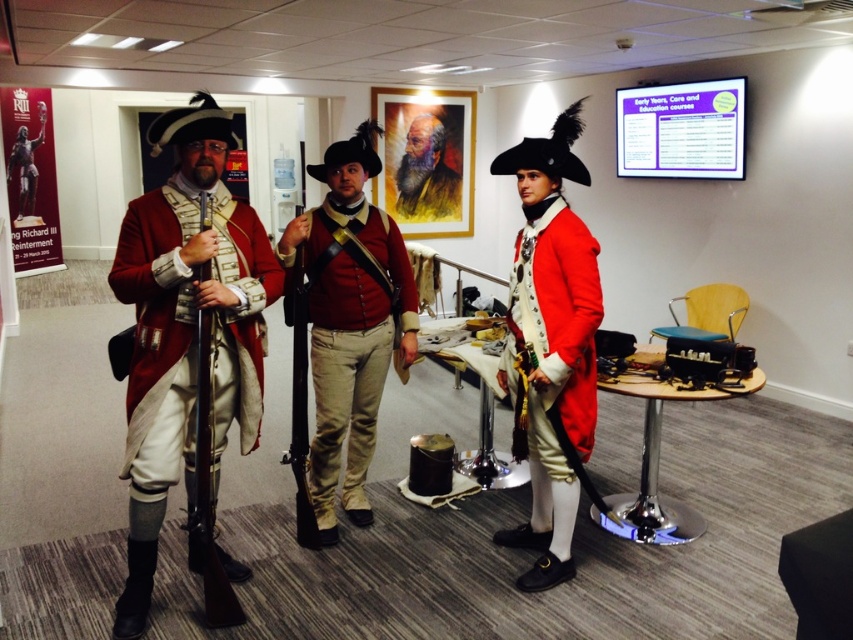
Between matte red coat at left and wooden smooth rifle at center, which one is positioned lower?

Positioned lower is wooden smooth rifle at center.

Is matte red coat at left further to camera compared to wooden smooth rifle at center?

No, matte red coat at left is in front of wooden smooth rifle at center.

Between point (173, 396) and point (212, 436), which one is positioned behind?

The point (173, 396) is more distant.

Find the location of a particular element. matte red coat at left is located at coordinates (186, 332).

Find the location of a particular element. Image resolution: width=853 pixels, height=640 pixels. matte red coat at left is located at coordinates (186, 332).

Looking at this image, is matte red coat at left further to the viewer compared to matte red coat at center?

No, it is not.

What do you see at coordinates (186, 332) in the screenshot?
I see `matte red coat at left` at bounding box center [186, 332].

Image resolution: width=853 pixels, height=640 pixels. Identify the location of matte red coat at left. (186, 332).

Is matte red vest at center shorter than wooden smooth rifle at center?

Incorrect, matte red vest at center's height does not fall short of wooden smooth rifle at center's.

Who is lower down, matte red vest at center or wooden smooth rifle at center?

wooden smooth rifle at center

What do you see at coordinates (350, 337) in the screenshot? This screenshot has height=640, width=853. I see `matte red vest at center` at bounding box center [350, 337].

Locate an element on the screen. matte red vest at center is located at coordinates (350, 337).